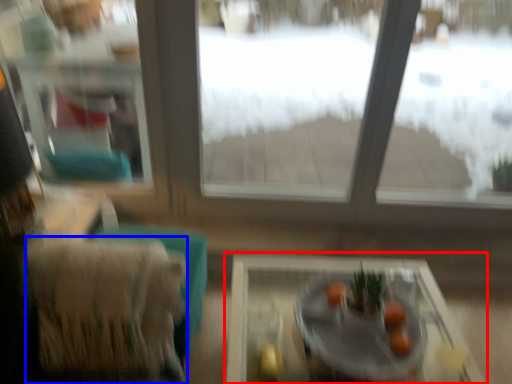
Question: Which of the following is the closest to the observer, table (highlighted by a red box) or armchair (highlighted by a blue box)?

Choices:
 (A) table
 (B) armchair

Answer: (A)